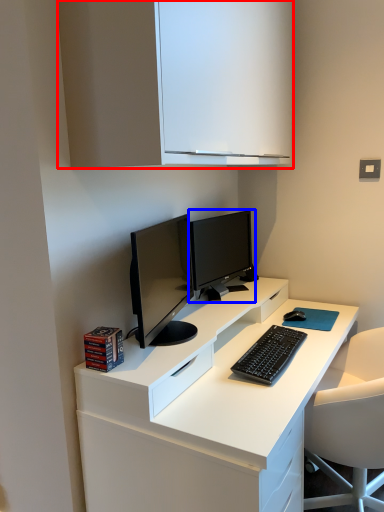
Question: Which point is closer to the camera, cabinetry (highlighted by a red box) or computer monitor (highlighted by a blue box)?

Choices:
 (A) cabinetry
 (B) computer monitor

Answer: (A)